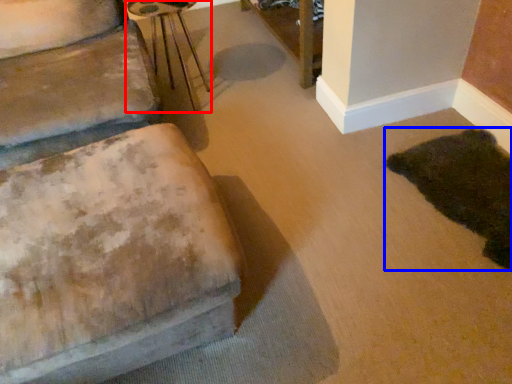
Question: Which of the following is the closest to the observer, side table (highlighted by a red box) or animal (highlighted by a blue box)?

Choices:
 (A) side table
 (B) animal

Answer: (B)